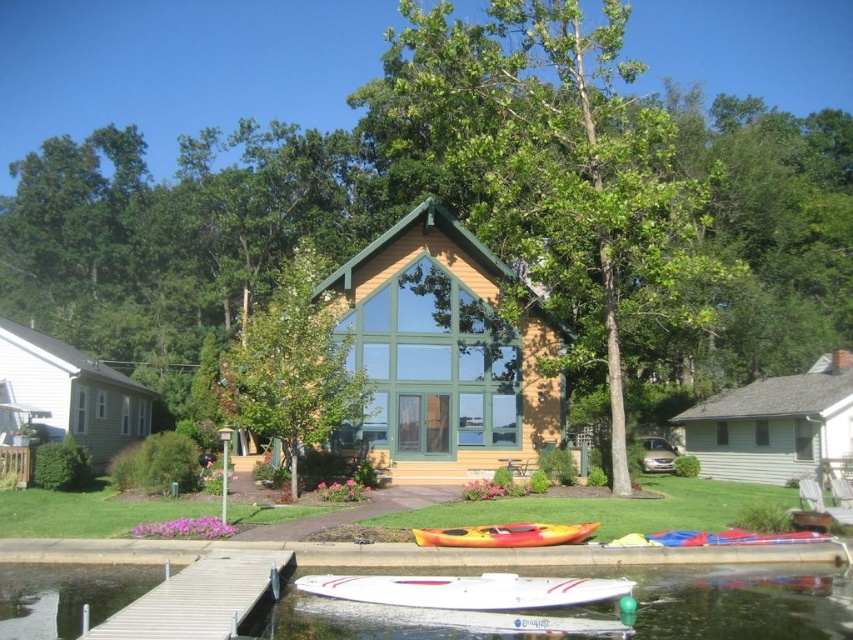
You are standing on the lawn in front of the house and see the point at coordinates (x=198, y=596). Is this point located on the white wood dock at lower left or somewhere else?

The point at coordinates (x=198, y=596) is located on the white wood dock at lower left.

You are a visitor who wants to park your car near the wooden cabin at center and the white glossy boat at lower center. Based on their sizes, which one would require more space to park next to?

The wooden cabin at center is wider than the white glossy boat at lower center, so it would require more space to park next to.

You are standing at the point with coordinates (445, 353) in a suburban scene. What object is exactly at your current location?

The wooden cabin at center is located at point (445, 353).